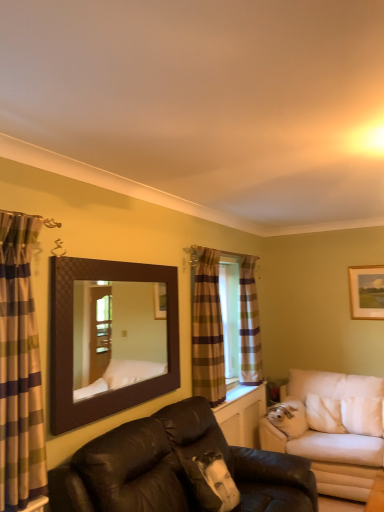
Question: Is brown textured mirror at upper center positioned with its back to plaid fabric curtain at center, marked as the second curtain in a left-to-right arrangement?

Choices:
 (A) no
 (B) yes

Answer: (A)

Question: Can you confirm if brown textured mirror at upper center is thinner than plaid fabric curtain at center, placed as the second curtain when sorted from right to left?

Choices:
 (A) no
 (B) yes

Answer: (B)

Question: Considering the relative sizes of brown textured mirror at upper center and plaid fabric curtain at center, marked as the second curtain in a left-to-right arrangement, in the image provided, is brown textured mirror at upper center shorter than plaid fabric curtain at center, marked as the second curtain in a left-to-right arrangement,?

Choices:
 (A) no
 (B) yes

Answer: (B)

Question: Considering the relative positions of brown textured mirror at upper center and plaid fabric curtain at center, which ranks as the second curtain in back-to-front order, in the image provided, is brown textured mirror at upper center to the right of plaid fabric curtain at center, which ranks as the second curtain in back-to-front order, from the viewer's perspective?

Choices:
 (A) no
 (B) yes

Answer: (A)

Question: Is brown textured mirror at upper center taller than plaid fabric curtain at center, marked as the second curtain in a left-to-right arrangement?

Choices:
 (A) no
 (B) yes

Answer: (A)

Question: Is wooden framed picture at upper right in front of or behind leather couch at center, which is the 1th studio couch in front-to-back order, in the image?

Choices:
 (A) front
 (B) behind

Answer: (B)

Question: From a real-world perspective, relative to leather couch at center, which is the 1th studio couch in front-to-back order, is wooden framed picture at upper right vertically above or below?

Choices:
 (A) below
 (B) above

Answer: (B)

Question: Considering the positions of wooden framed picture at upper right and leather couch at center, which is the 1th studio couch in front-to-back order, in the image, is wooden framed picture at upper right taller or shorter than leather couch at center, which is the 1th studio couch in front-to-back order,?

Choices:
 (A) short
 (B) tall

Answer: (A)

Question: In terms of width, does wooden framed picture at upper right look wider or thinner when compared to leather couch at center, which is counted as the 1th studio couch, starting from the left?

Choices:
 (A) thin
 (B) wide

Answer: (A)

Question: Based on their sizes in the image, would you say leather couch at center, which ranks as the 2th studio couch in back-to-front order, is bigger or smaller than white fabric studio couch at right, which ranks as the 2th studio couch in left-to-right order?

Choices:
 (A) big
 (B) small

Answer: (A)

Question: From a real-world perspective, is leather couch at center, which is the 1th studio couch in front-to-back order, above or below white fabric studio couch at right, which ranks as the 2th studio couch in left-to-right order?

Choices:
 (A) below
 (B) above

Answer: (B)

Question: Is leather couch at center, which is counted as the 1th studio couch, starting from the left, in front of or behind white fabric studio couch at right, which ranks as the 2th studio couch in left-to-right order, in the image?

Choices:
 (A) behind
 (B) front

Answer: (B)

Question: Is leather couch at center, which is the 1th studio couch in front-to-back order, situated inside white fabric studio couch at right, placed as the first studio couch when sorted from right to left, or outside?

Choices:
 (A) outside
 (B) inside

Answer: (A)

Question: Is leather couch at center, which ranks as the 2th studio couch in back-to-front order, to the left or to the right of brown textured mirror at upper center in the image?

Choices:
 (A) right
 (B) left

Answer: (A)

Question: Is leather couch at center, which is counted as the 1th studio couch, starting from the left, taller or shorter than brown textured mirror at upper center?

Choices:
 (A) short
 (B) tall

Answer: (B)